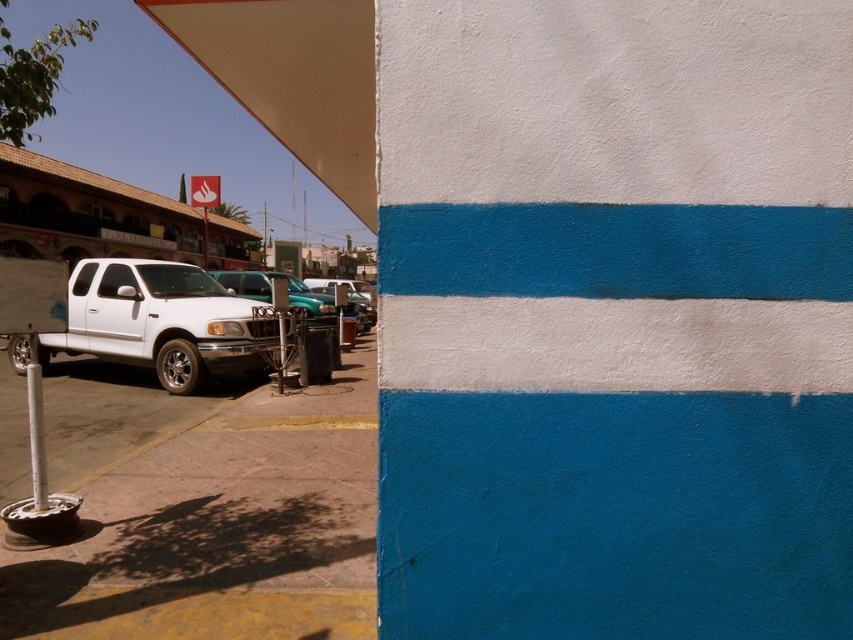
You are standing at the point marked by coordinates point (270, 291) in the image. What vehicle are you currently standing on?

You are standing on the metallic teal sedan at center, which is located at point (270, 291).

You are a pedestrian standing on the sidewalk and want to cross the street to reach the bright blue and white wall on the right. Which vehicle should you walk around first, the matte white pickup truck at left or the metallic teal sedan at center, to get to the wall?

The matte white pickup truck at left is positioned on the left side of the metallic teal sedan at center, so you should walk around the matte white pickup truck at left first to reach the wall.

Based on the photo, you are standing at the point with coordinates point (265, 300) and want to walk to the point with coordinates point (253, 372). Which direction should you move in to reach your destination?

You should move forward because point (253, 372) is in front of point (265, 300).